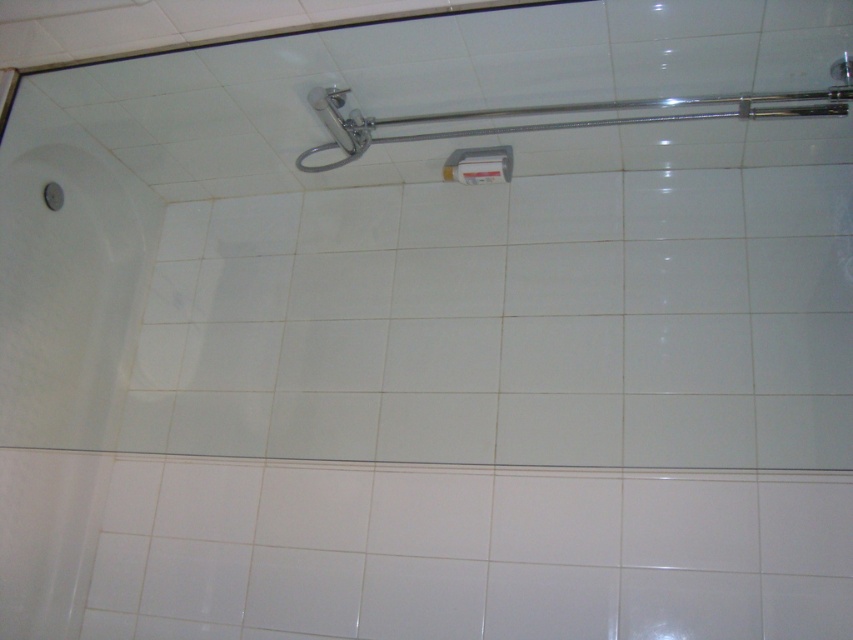
Question: Is chrome/metallic shower arm at upper center smaller than white plastic towel bar at upper center?

Choices:
 (A) yes
 (B) no

Answer: (B)

Question: Which of the following is the farthest from the observer?

Choices:
 (A) white plastic towel bar at upper center
 (B) chrome/metallic shower arm at upper center

Answer: (A)

Question: Is chrome/metallic shower arm at upper center wider than white plastic towel bar at upper center?

Choices:
 (A) yes
 (B) no

Answer: (A)

Question: Does chrome/metallic shower arm at upper center lie in front of white plastic towel bar at upper center?

Choices:
 (A) yes
 (B) no

Answer: (A)